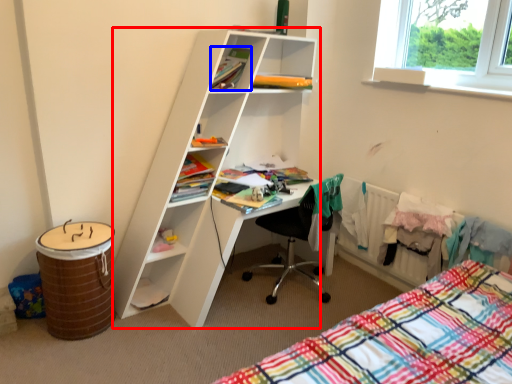
Question: Which object appears closest to the camera in this image, shelf (highlighted by a red box) or book (highlighted by a blue box)?

Choices:
 (A) shelf
 (B) book

Answer: (A)